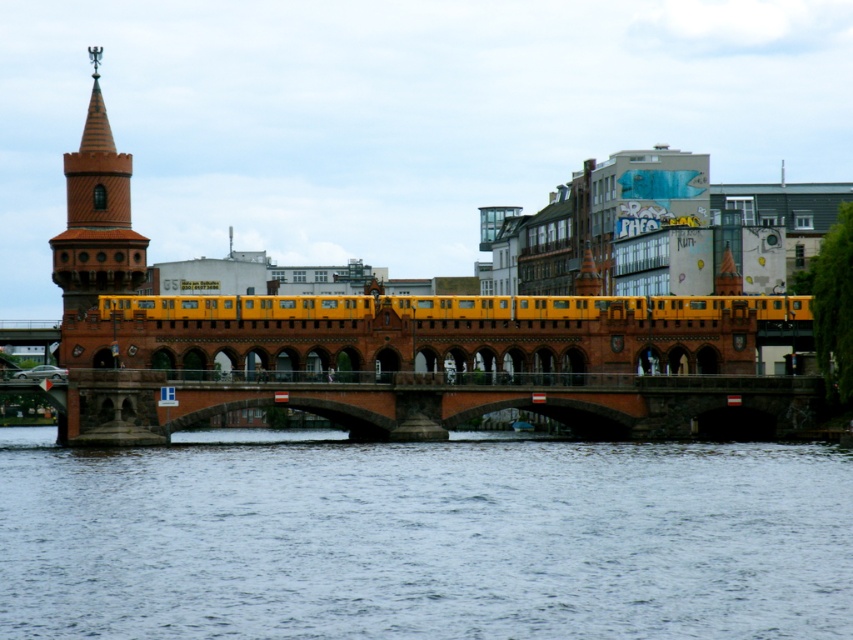
Question: Which is farther from the brick bridge at center?

Choices:
 (A) blue water at center
 (B) yellow matte train at center

Answer: (A)

Question: Is blue water at center smaller than brown brick tower at left?

Choices:
 (A) yes
 (B) no

Answer: (B)

Question: Does brick bridge at center have a lesser width compared to yellow matte train at center?

Choices:
 (A) yes
 (B) no

Answer: (A)

Question: Among these points, which one is farthest from the camera?

Choices:
 (A) (257, 397)
 (B) (795, 308)
 (C) (807, 508)

Answer: (B)

Question: Which point is closer to the camera?

Choices:
 (A) yellow matte train at center
 (B) brown brick tower at left

Answer: (A)

Question: Observing the image, what is the correct spatial positioning of brick bridge at center in reference to brown brick tower at left?

Choices:
 (A) above
 (B) below

Answer: (B)